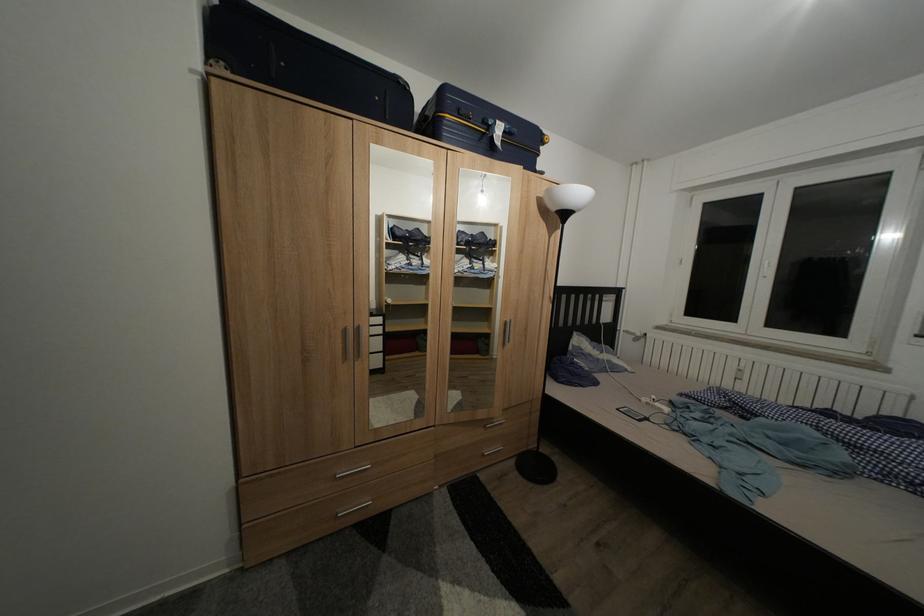
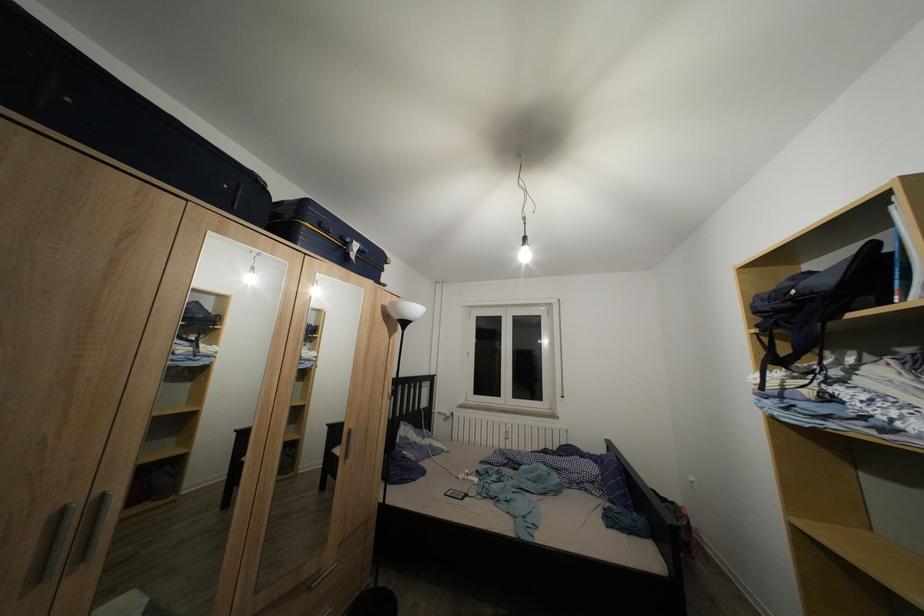
Question: I am providing you with two images of the same scene from different viewpoints. Which of the following objects are not visible in image2?

Choices:
 (A) dark blue suitcase
 (B) silver cabinet handle
 (C) white e-reader
 (D) none of these

Answer: (D)